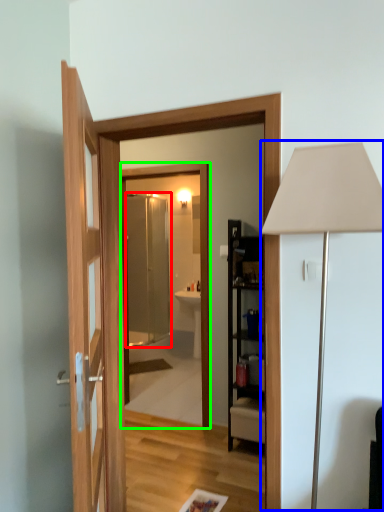
Question: Based on their relative distances, which object is nearer to screen door (highlighted by a red box)? Choose from table lamp (highlighted by a blue box) and mirror (highlighted by a green box).

Choices:
 (A) table lamp
 (B) mirror

Answer: (B)